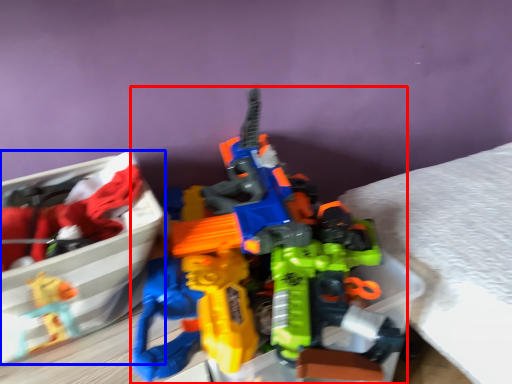
Question: Which object is further to the camera taking this photo, toy (highlighted by a red box) or wide (highlighted by a blue box)?

Choices:
 (A) toy
 (B) wide

Answer: (B)